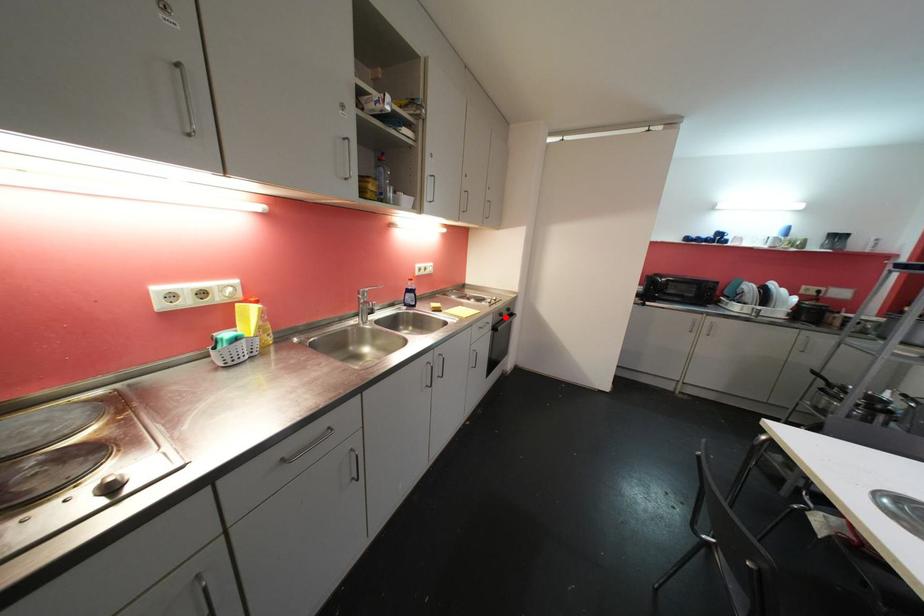
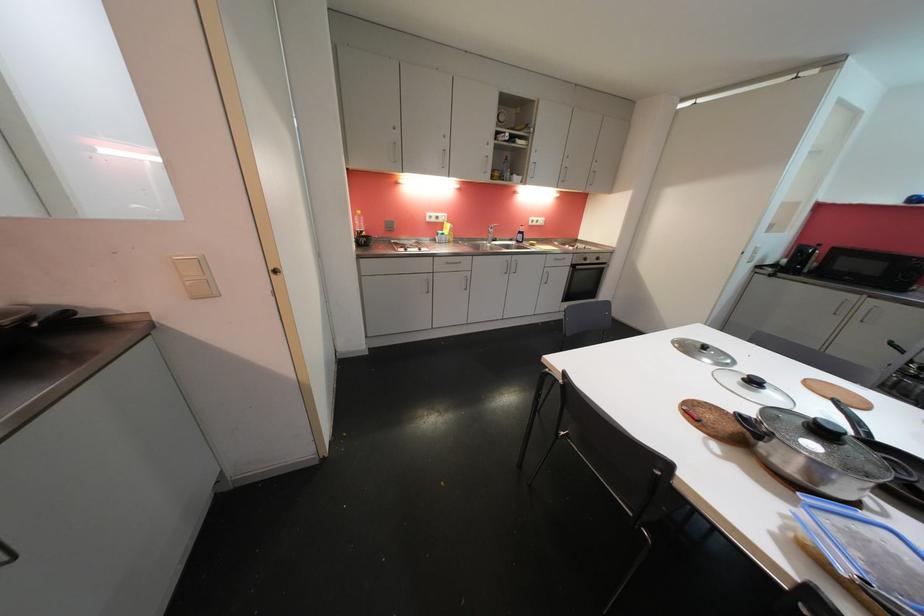
The point at the highlighted location is marked in the first image. Where is the corresponding point in the second image?

(590, 262)